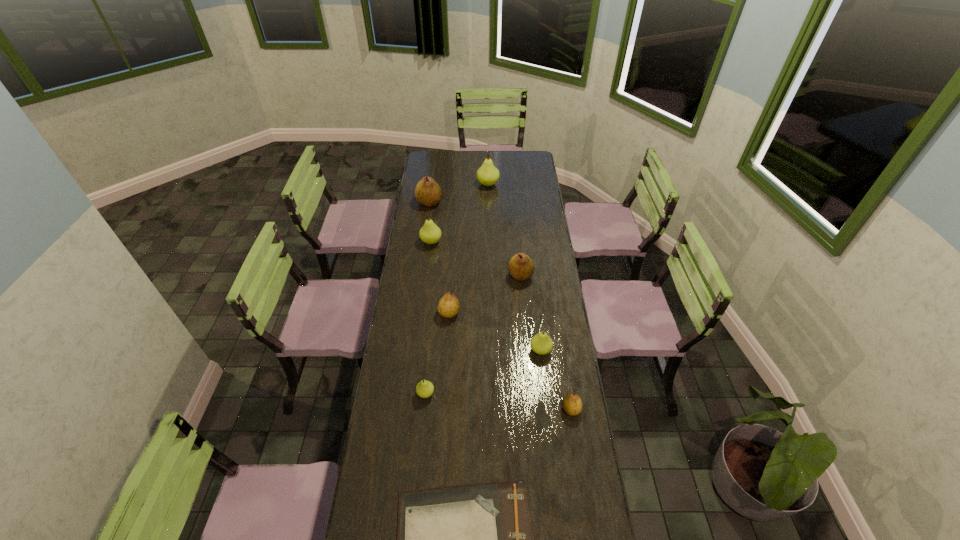
Find the location of `the fourth nearest object`. the fourth nearest object is located at coordinates (541, 343).

What are the coordinates of `the third farthest green pear` in the screenshot? It's located at (541, 343).

Identify the location of the nearest green pear. (424, 389).

At what (x,y) coordinates should I click in order to perform the action: click on the rightmost pear. Please return your answer as a coordinate pair (x, y). Looking at the image, I should click on (572, 405).

Where is `the rightmost brown pear`? the rightmost brown pear is located at coordinates (572, 405).

Where is `vacant space located on the back of the farthest object`? Image resolution: width=960 pixels, height=540 pixels. vacant space located on the back of the farthest object is located at coordinates (488, 170).

You are a GUI agent. You are given a task and a screenshot of the screen. Output one action in this format:
    pyautogui.click(x=<x>, y=<y>)
    Task: Click on the blank space located on the front of the second farthest object
    The image size is (960, 540).
    Given the screenshot: What is the action you would take?
    pyautogui.click(x=427, y=218)

This screenshot has height=540, width=960. Identify the location of vacant position located on the right of the third farthest pear. (505, 242).

Locate an element on the screen. This screenshot has height=540, width=960. blank space located on the front of the second farthest brown pear is located at coordinates (527, 355).

At what (x,y) coordinates should I click in order to perform the action: click on free spot located 0.330m on the back of the fifth farthest pear. Please return your answer as a coordinate pair (x, y). The height and width of the screenshot is (540, 960). Looking at the image, I should click on pyautogui.click(x=453, y=253).